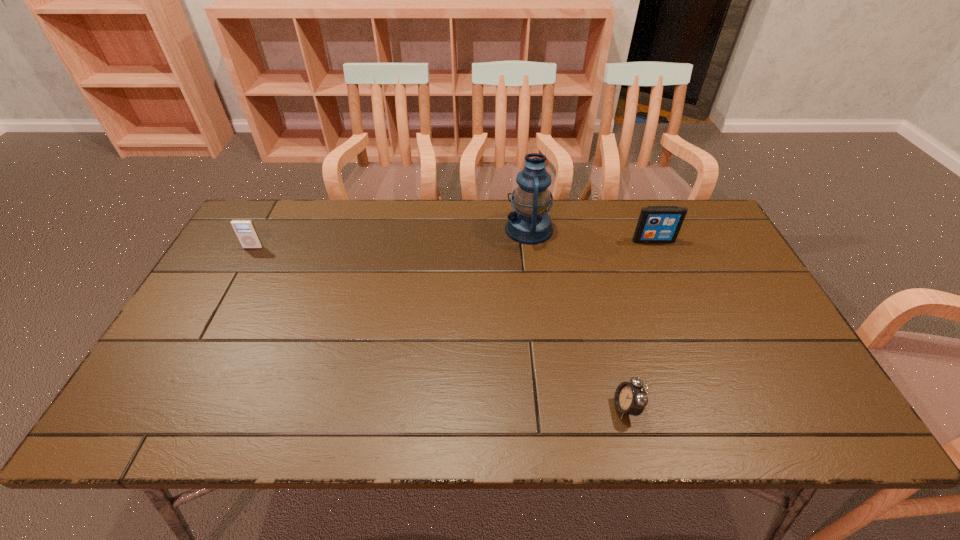
Find the location of a particular element. object that is at the far left corner is located at coordinates (245, 230).

Identify the location of object present at the far right corner. The height and width of the screenshot is (540, 960). (657, 224).

Identify the location of vacant position at the far edge of the desktop. (314, 231).

In the image, there is a desktop. What are the coordinates of `vacant space at the near edge` in the screenshot? It's located at (221, 421).

This screenshot has width=960, height=540. In the image, there is a desktop. Identify the location of free space at the left edge. (168, 375).

Find the location of a particular element. The width and height of the screenshot is (960, 540). free space at the right edge of the desktop is located at coordinates (695, 247).

Where is `vacant area that lies between the second object from left to right and the alarm clock`? The image size is (960, 540). vacant area that lies between the second object from left to right and the alarm clock is located at coordinates (578, 318).

You are a GUI agent. You are given a task and a screenshot of the screen. Output one action in this format:
    pyautogui.click(x=<x>, y=<y>)
    Task: Click on the free spot between the tallest object and the shorter iPod
    The image size is (960, 540).
    Given the screenshot: What is the action you would take?
    pyautogui.click(x=391, y=238)

Where is `free space between the second tallest object and the lantern`? This screenshot has width=960, height=540. free space between the second tallest object and the lantern is located at coordinates (x=591, y=234).

The width and height of the screenshot is (960, 540). I want to click on vacant area between the tallest object and the alarm clock, so click(x=578, y=318).